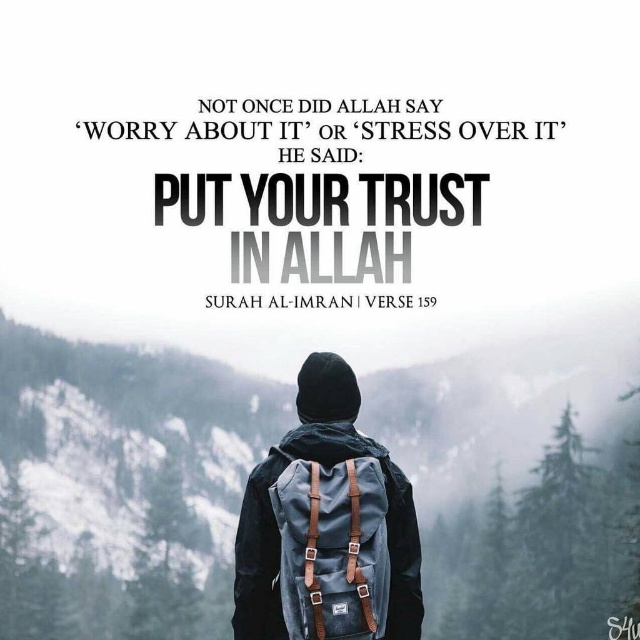
You are a photographer trying to capture the motivational quote in the image. You notice two objects labeled gray matte backpack at center and matte gray backpack at center. Which backpack is closer to the quote text?

The gray matte backpack at center is positioned under matte gray backpack at center, so the matte gray backpack at center is closer to the quote text.

You are a photographer trying to capture the motivational quote in the image. The quote is displayed below the gray matte backpack at center. To ensure the quote is fully visible in your photo, where should you position the backpack?

The gray matte backpack at center is located at point (122, 486). To ensure the quote below it is fully visible, you should position the backpack so that it does not cover the area where the quote is displayed.